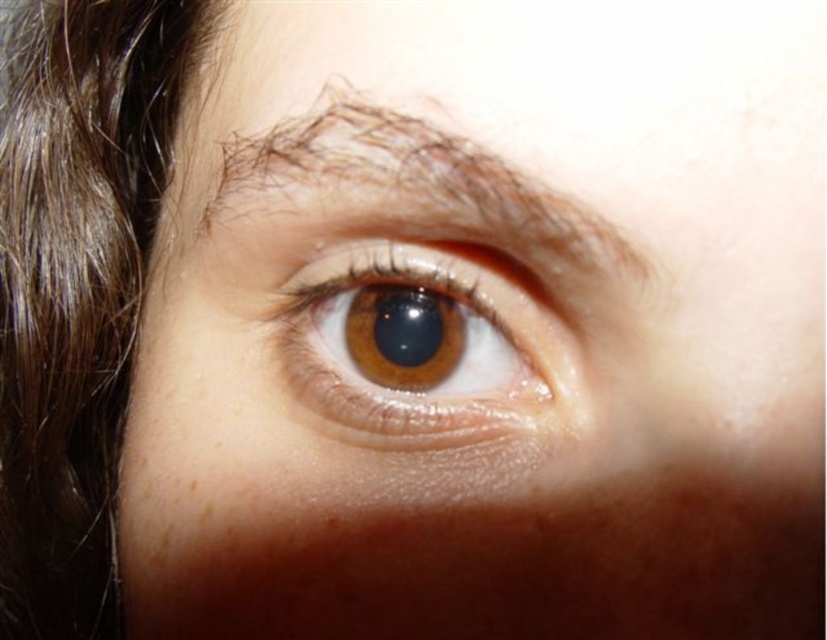
You are a photographer adjusting the lighting for a closeup portrait. You notice the brown shiny hair at left in the frame. Based on the scene description, where is the brown shiny hair positioned relative to the eye?

The brown shiny hair at left is located at point 0.447 on the horizontal axis and 0.093 on the vertical axis relative to the eye.

You are a makeup artist preparing to apply eyeliner to the brown matte eye at center. The brown shiny hair at left is partially covering the eye. Can you apply eyeliner without moving the hair?

The brown shiny hair at left is in front of the brown matte eye at center, so you would need to either move the hair or work around it to apply eyeliner effectively.

You are a photographer adjusting the focus on your camera. You want to ensure that both the point at point [380,282] and the point at point [595,252] are in focus. Which point should you focus on first to ensure the other is also in focus?

You should focus on point [380,282] first because it is closer to the camera than point [595,252]. By focusing on the closer point, the depth of field will likely include the farther point as well.